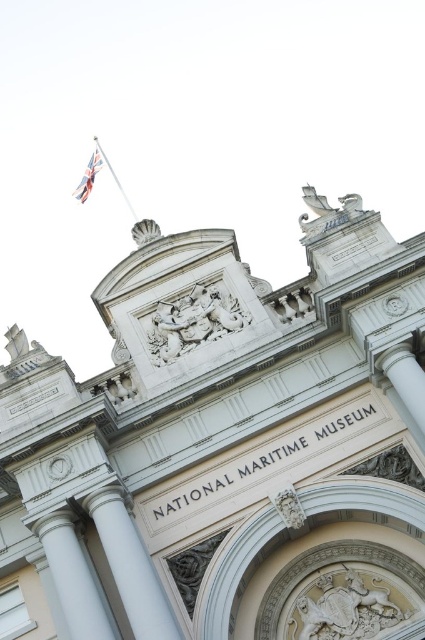
You are a visitor standing in front of the National Maritime Museum. You notice a shiny object at the point marked as point (88, 176). What is this object?

The point (88, 176) corresponds to the polished silver flag at upper left.

You are a visitor standing in front of the National Maritime Museum. You notice two objects at the upper left section of the building facade. One is the polished silver flag at upper left and the other is the polished silver flag pole at upper left. Which of these two objects is located to the left of the other?

The polished silver flag at upper left is positioned on the left side of the polished silver flag pole at upper left.

You are standing in front of the National Maritime Museum. You want to locate the polished silver flag at upper left. According to the coordinates provided, where should you look?

You should look at point (x=88, y=176) to find the polished silver flag at upper left.